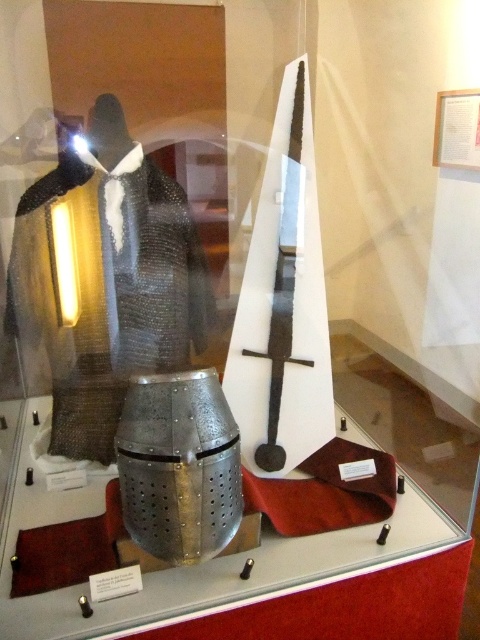
Question: Which point appears farthest from the camera in this image?

Choices:
 (A) tap(141, 205)
 (B) tap(233, 470)

Answer: (A)

Question: Which object is positioned farthest from the polished steel sword at center?

Choices:
 (A) polished silver helmet at center
 (B) chainmail armor at left

Answer: (A)

Question: Can you confirm if chainmail armor at left is positioned below polished silver helmet at center?

Choices:
 (A) no
 (B) yes

Answer: (A)

Question: Does polished silver helmet at center have a larger size compared to polished steel sword at center?

Choices:
 (A) yes
 (B) no

Answer: (A)

Question: Is chainmail armor at left positioned before polished silver helmet at center?

Choices:
 (A) no
 (B) yes

Answer: (A)

Question: Based on their relative distances, which object is nearer to the chainmail armor at left?

Choices:
 (A) polished silver helmet at center
 (B) polished steel sword at center

Answer: (B)